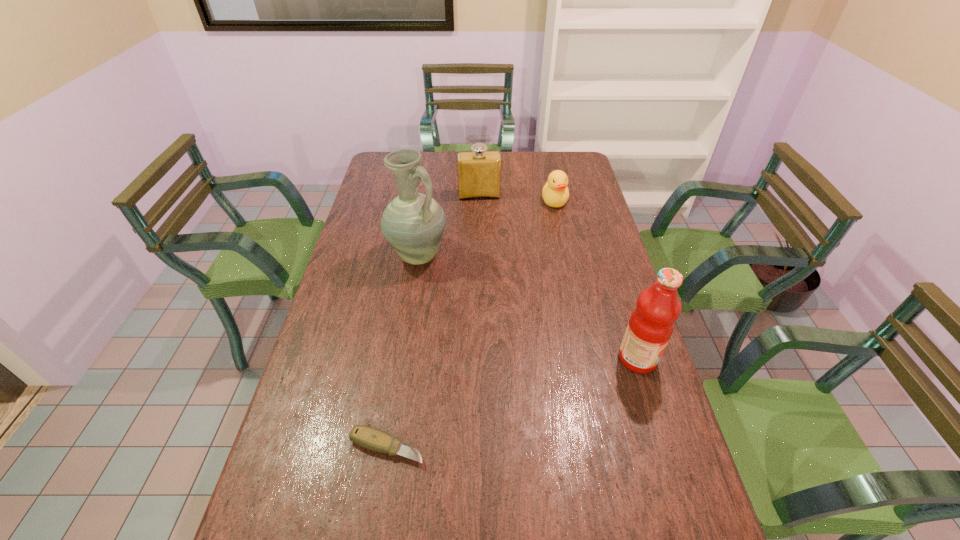
This screenshot has width=960, height=540. In order to click on free spot on the desktop that is between the nearest object and the fruit juice and is positioned on the front-facing side of the third object from left to right in this screenshot , I will do `click(503, 406)`.

Locate an element on the screen. The height and width of the screenshot is (540, 960). vacant space on the desktop that is between the shortest object and the fruit juice and is positioned at the beak of the second object from right to left is located at coordinates (553, 389).

Where is `vacant space on the desktop that is between the shortest object and the second nearest object and is positioned on the handle side of the tallest object`? vacant space on the desktop that is between the shortest object and the second nearest object and is positioned on the handle side of the tallest object is located at coordinates (508, 404).